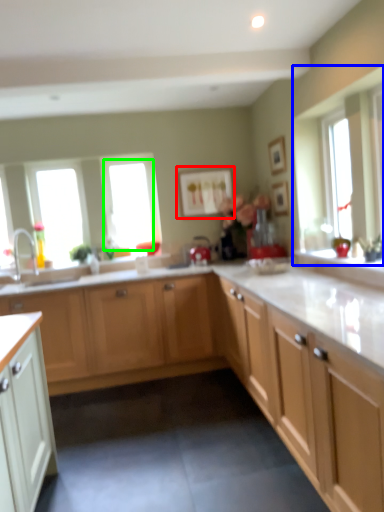
Question: Based on their relative distances, which object is nearer to picture frame (highlighted by a red box)? Choose from window (highlighted by a blue box) and window (highlighted by a green box).

Choices:
 (A) window
 (B) window

Answer: (B)